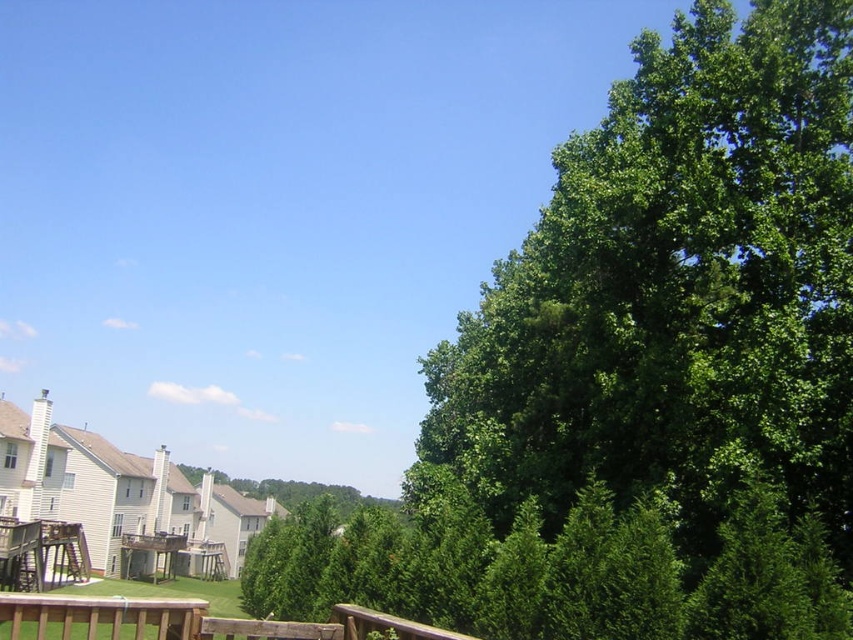
Does green leafy tree at upper right have a smaller size compared to brown wooden porch at lower left?

No.

Does green leafy tree at upper right come in front of brown wooden porch at lower left?

That is False.

Who is more forward, (618,296) or (196,632)?

Point (196,632) is in front.

I want to click on green leafy tree at upper right, so click(641, 374).